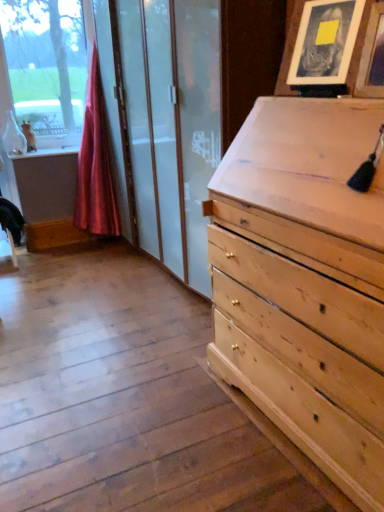
Question: Considering their positions, is silky red curtain at left located in front of or behind wooden picture frame at upper right, the second picture frame positioned from the back?

Choices:
 (A) behind
 (B) front

Answer: (A)

Question: Is silky red curtain at left spatially inside wooden picture frame at upper right, which is the first picture frame from front to back, or outside of it?

Choices:
 (A) outside
 (B) inside

Answer: (A)

Question: Estimate the real-world distances between objects in this image. Which object is farther from the silky red curtain at left?

Choices:
 (A) wooden picture frame at upper right, the second picture frame positioned from the back
 (B) matte wooden picture frame at upper right, which appears as the first picture frame when viewed from the back

Answer: (A)

Question: Which object is the farthest from the wooden picture frame at upper right, the second picture frame positioned from the back?

Choices:
 (A) silky red curtain at left
 (B) matte wooden picture frame at upper right, which appears as the first picture frame when viewed from the back

Answer: (A)